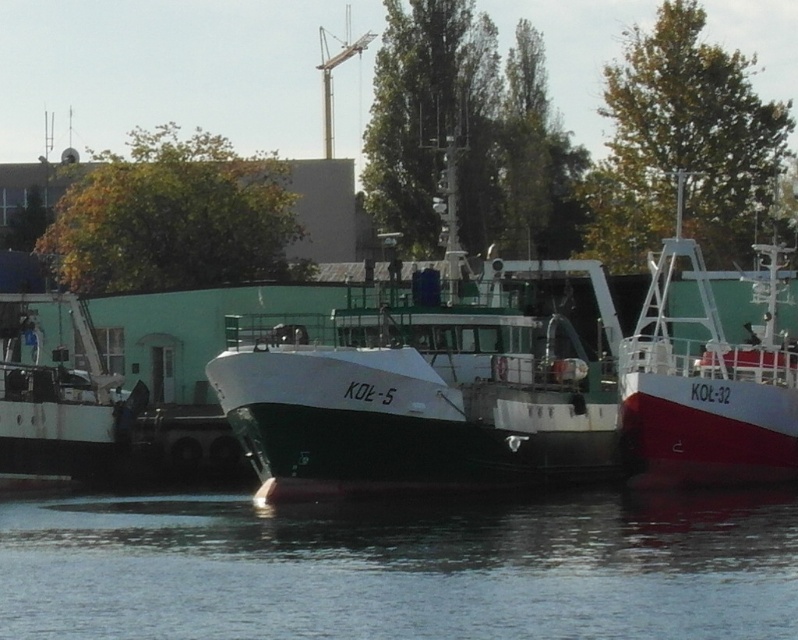
You are a delivery drone that needs to fly over the transparent water at center and the red glossy boat at center. Which one requires you to fly higher to avoid collision?

The transparent water at center might be wider than the red glossy boat at center, so you need to fly higher over the transparent water at center to avoid collision.

You are a dock worker who needs to load cargo onto both the green matte boat at center and the red glossy boat at center. If the cargo containers are 10 meters wide, which boat can accommodate them based on their widths?

The green matte boat at center has a greater width than the red glossy boat at center. Therefore, the green matte boat at center can accommodate the 10 meter wide cargo containers if its width is sufficient, but the red glossy boat at center cannot since it is narrower.